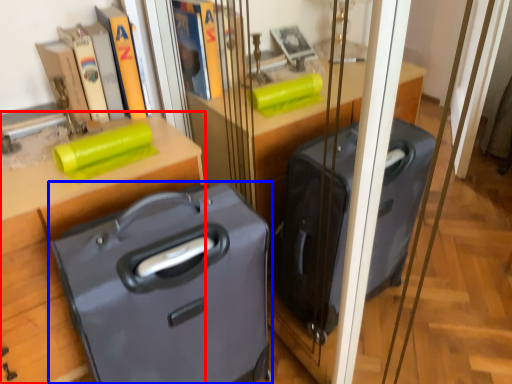
Question: Which object is further to the camera taking this photo, furniture (highlighted by a red box) or suitcase (highlighted by a blue box)?

Choices:
 (A) furniture
 (B) suitcase

Answer: (A)